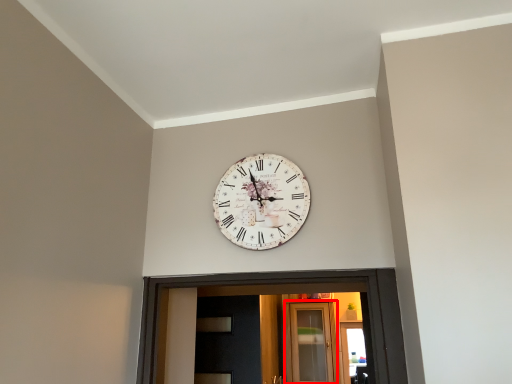
Question: From the image's perspective, where is glass door (annotated by the red box) located relative to wall clock?

Choices:
 (A) below
 (B) above

Answer: (A)